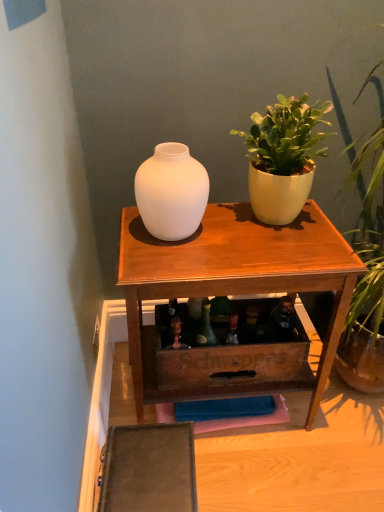
Question: From the image's perspective, is matte white vase at center above or below matte yellow pot at upper right?

Choices:
 (A) below
 (B) above

Answer: (A)

Question: From a real-world perspective, is matte white vase at center positioned above or below matte yellow pot at upper right?

Choices:
 (A) above
 (B) below

Answer: (B)

Question: Estimate the real-world distances between objects in this image. Which object is farther from the matte white vase at center?

Choices:
 (A) matte yellow pot at upper right
 (B) matte white vase at upper center

Answer: (B)

Question: Which object is the farthest from the matte white vase at center?

Choices:
 (A) matte yellow pot at upper right
 (B) matte white vase at upper center

Answer: (B)